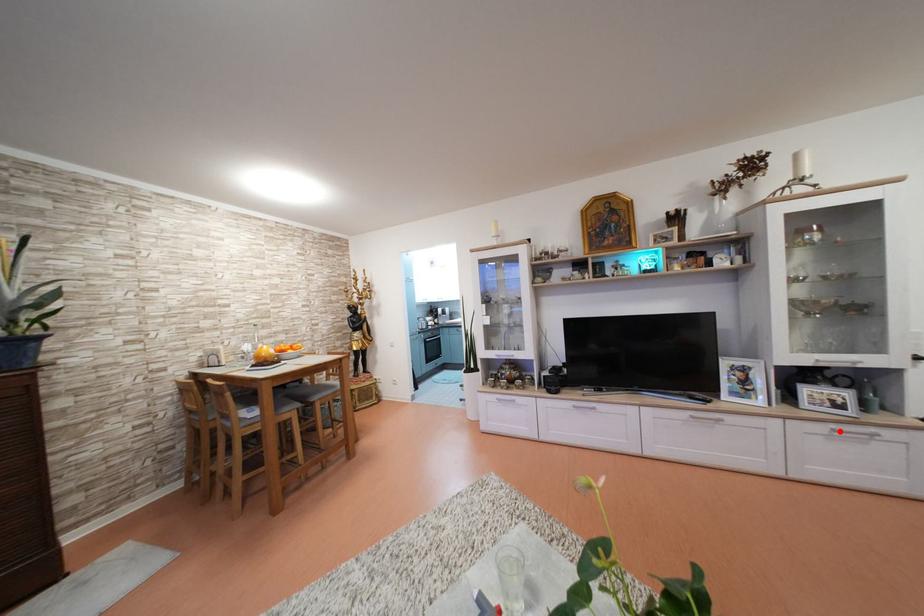
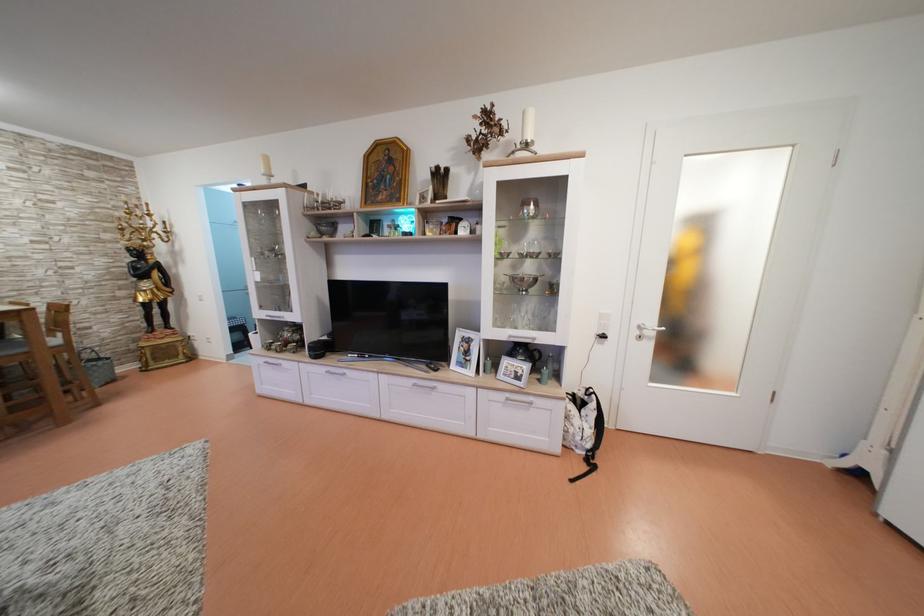
The point at the highlighted location is marked in the first image. Where is the corresponding point in the second image?

(515, 400)